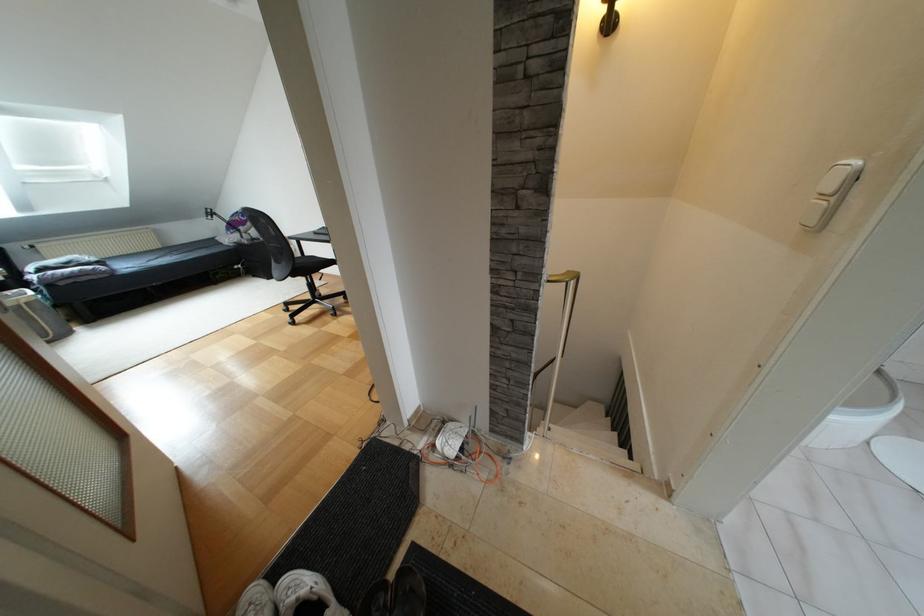
Where would you sit the black chair sitting surface? Please return your answer as a coordinate pair (x, y).

(310, 265)